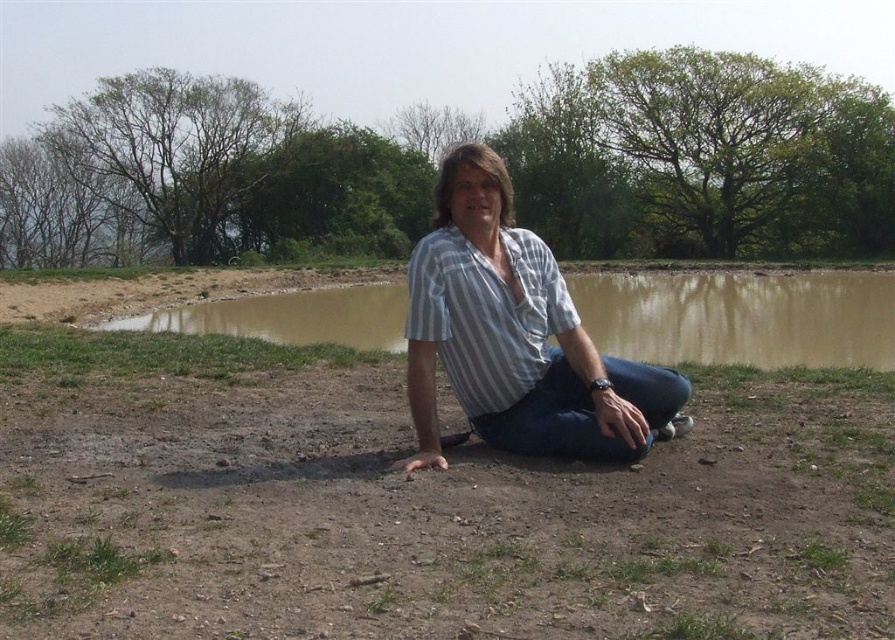
You are planning to wash your striped cotton shirt at center in the brown muddy water at center. Considering their sizes, will the shirt fit comfortably in the water without being submerged entirely?

The striped cotton shirt at center has a smaller size compared to brown muddy water at center, so the shirt will fit comfortably in the water and can be submerged entirely.

You are a photographer trying to capture the striped cotton shirt at center and the brown dirt field at center in the same frame. Based on their positions, which object should you focus on first to ensure both are in focus?

The brown dirt field at center is closer to the viewer than the striped cotton shirt at center. To ensure both are in focus, you should focus on the brown dirt field at center first since it is the closer object.

You are a photographer trying to capture the striped cotton shirt at center and the brown muddy water at center in a single shot. Based on their positions, which object should you focus on first to ensure both are in frame?

The striped cotton shirt at center is located below brown muddy water at center. Since the shirt is lower in the frame, you should focus on the shirt first to ensure both objects are included in the shot.